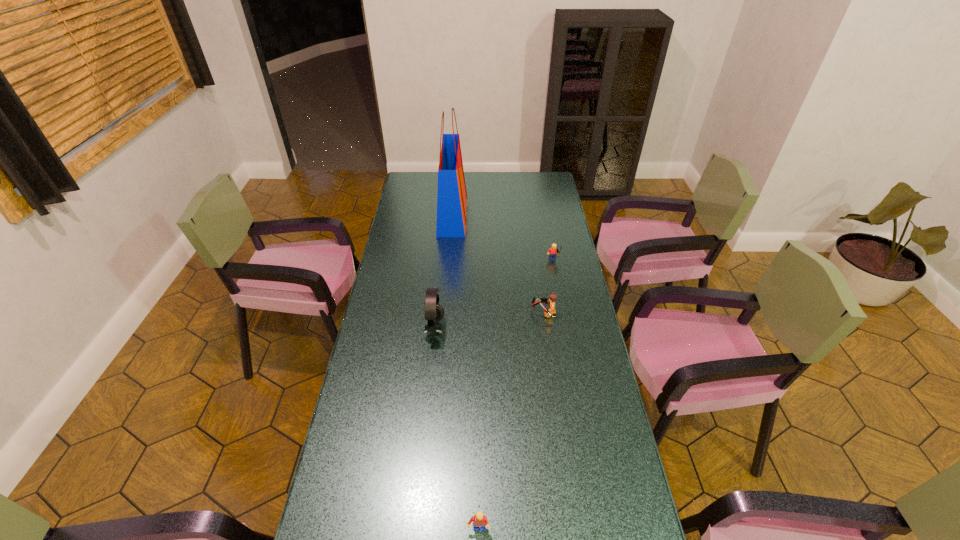
At what (x,y) coordinates should I click in order to perform the action: click on free space located 0.370m on the ear cups of the earphone. Please return your answer as a coordinate pair (x, y). Looking at the image, I should click on (543, 329).

Where is `free region located on the front-facing side of the fourth nearest object`? free region located on the front-facing side of the fourth nearest object is located at coordinates (558, 287).

Locate an element on the screen. vacant area situated holding a crossbow in the hands of the second object from right to left is located at coordinates [511, 313].

I want to click on vacant space located holding a crossbow in the hands of the second object from right to left, so click(x=439, y=313).

At what (x,y) coordinates should I click in order to perform the action: click on blank area located 0.160m holding a crossbow in the hands of the second object from right to left. Please return your answer as a coordinate pair (x, y). This screenshot has height=540, width=960. Looking at the image, I should click on (491, 313).

Locate an element on the screen. The width and height of the screenshot is (960, 540). vacant region at the far edge of the desktop is located at coordinates (435, 189).

Image resolution: width=960 pixels, height=540 pixels. Find the location of `vacant space at the left edge of the desktop`. vacant space at the left edge of the desktop is located at coordinates (403, 243).

Find the location of a particular element. free space at the right edge of the desktop is located at coordinates (572, 274).

Where is `vacant space at the far left corner of the desktop`? The image size is (960, 540). vacant space at the far left corner of the desktop is located at coordinates (411, 192).

Where is `vacant point at the far right corner`? This screenshot has height=540, width=960. vacant point at the far right corner is located at coordinates click(534, 172).